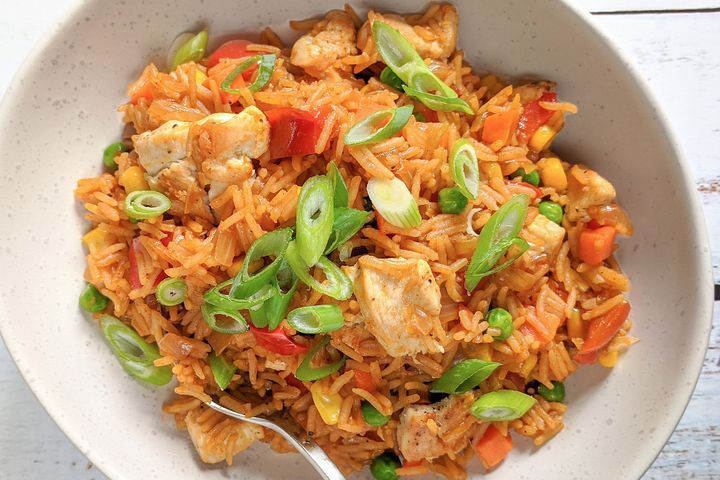
Where is `fork`? fork is located at coordinates (284, 421).